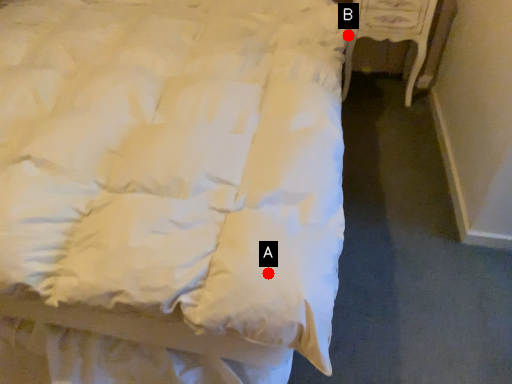
Question: Two points are circled on the image, labeled by A and B beside each circle. Among these points, which one is farthest from the camera?

Choices:
 (A) A is further
 (B) B is further

Answer: (B)